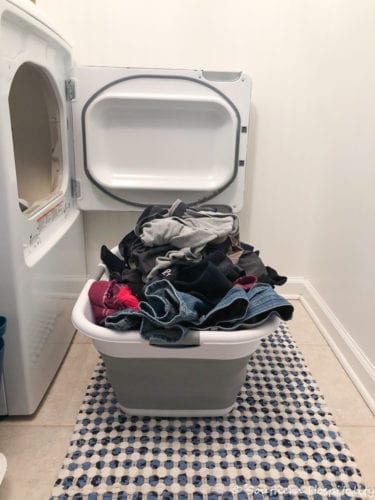
You are a GUI agent. You are given a task and a screenshot of the screen. Output one action in this format:
    pyautogui.click(x=<x>, y=<y>)
    Task: Click on the floor tiles
    The image size is (375, 500).
    Given the screenshot: What is the action you would take?
    pyautogui.click(x=338, y=399), pyautogui.click(x=60, y=438), pyautogui.click(x=73, y=375), pyautogui.click(x=80, y=338), pyautogui.click(x=303, y=330), pyautogui.click(x=352, y=441)